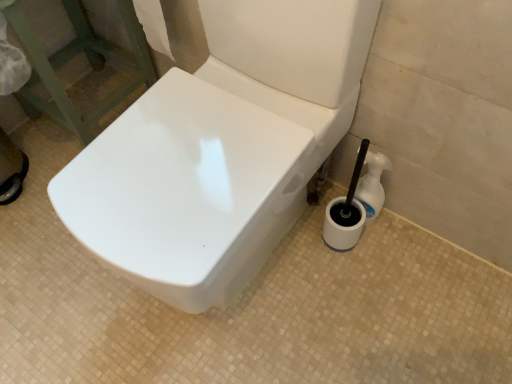
Question: Is white plastic bottle at lower right not inside white paper at upper left?

Choices:
 (A) yes
 (B) no

Answer: (A)

Question: From a real-world perspective, is white plastic bottle at lower right beneath white paper at upper left?

Choices:
 (A) yes
 (B) no

Answer: (A)

Question: Is white plastic bottle at lower right behind white paper at upper left?

Choices:
 (A) no
 (B) yes

Answer: (B)

Question: Is white plastic bottle at lower right smaller than white paper at upper left?

Choices:
 (A) no
 (B) yes

Answer: (B)

Question: Is white paper at upper left located within white plastic bottle at lower right?

Choices:
 (A) yes
 (B) no

Answer: (B)

Question: From the image's perspective, would you say white plastic bottle at lower right is shown under white paper at upper left?

Choices:
 (A) yes
 (B) no

Answer: (A)

Question: Is white paper at upper left surrounding white plastic bottle at lower right?

Choices:
 (A) yes
 (B) no

Answer: (B)

Question: Considering the relative sizes of white paper at upper left and white plastic bottle at lower right in the image provided, is white paper at upper left smaller than white plastic bottle at lower right?

Choices:
 (A) no
 (B) yes

Answer: (A)

Question: Considering the relative sizes of white paper at upper left and white plastic bottle at lower right in the image provided, is white paper at upper left wider than white plastic bottle at lower right?

Choices:
 (A) yes
 (B) no

Answer: (A)

Question: Is white paper at upper left next to white plastic bottle at lower right and touching it?

Choices:
 (A) no
 (B) yes

Answer: (A)

Question: Considering the relative positions of white paper at upper left and white plastic bottle at lower right in the image provided, is white paper at upper left to the right of white plastic bottle at lower right from the viewer's perspective?

Choices:
 (A) yes
 (B) no

Answer: (B)

Question: Is white paper at upper left aimed at white plastic bottle at lower right?

Choices:
 (A) no
 (B) yes

Answer: (A)

Question: Is point (166, 44) closer or farther from the camera than point (376, 162)?

Choices:
 (A) farther
 (B) closer

Answer: (A)